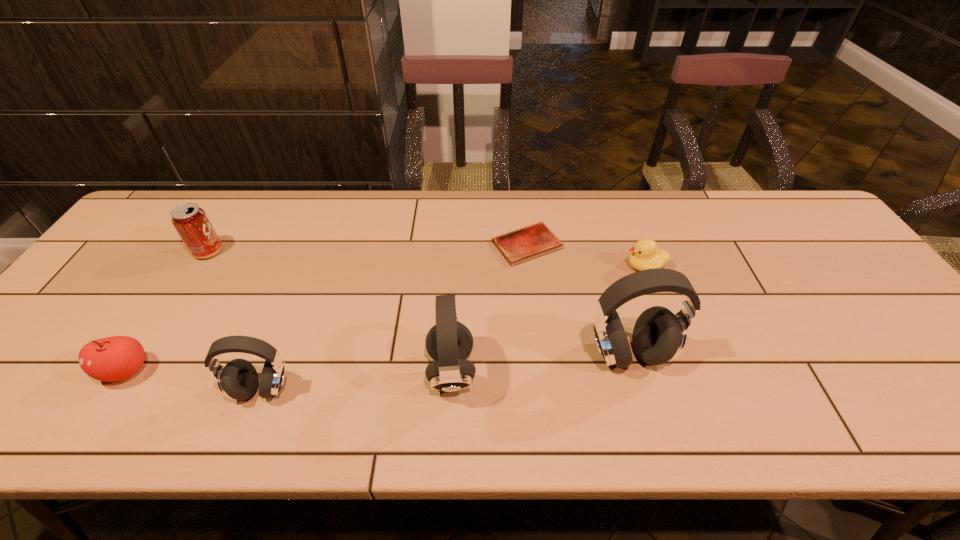
I want to click on the fifth tallest object, so click(110, 359).

This screenshot has width=960, height=540. Identify the location of vacant space located on the ear cups of the sixth shortest object. (498, 371).

Locate an element on the screen. This screenshot has height=540, width=960. free space located 0.060m on the back of the soda can is located at coordinates (223, 228).

Locate an element on the screen. This screenshot has width=960, height=540. vacant region located on the left of the diary is located at coordinates (367, 245).

You are a GUI agent. You are given a task and a screenshot of the screen. Output one action in this format:
    pyautogui.click(x=<x>, y=<y>)
    Task: Click on the blank area located 0.370m on the beak of the second shortest object
    This screenshot has width=960, height=540.
    Given the screenshot: What is the action you would take?
    pyautogui.click(x=490, y=267)

Where is `vacant space located 0.190m on the beak of the second shortest object`? The image size is (960, 540). vacant space located 0.190m on the beak of the second shortest object is located at coordinates (555, 267).

Where is `free space located on the beak of the second shortest object`? The height and width of the screenshot is (540, 960). free space located on the beak of the second shortest object is located at coordinates (591, 267).

The height and width of the screenshot is (540, 960). Find the location of `vacant point located on the left of the apple`. vacant point located on the left of the apple is located at coordinates (30, 370).

In order to click on object that is at the far edge in this screenshot , I will do click(519, 246).

Find the location of a particular element. apple present at the near edge is located at coordinates (110, 359).